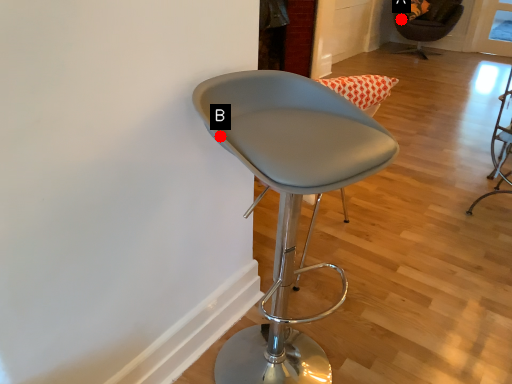
Question: Two points are circled on the image, labeled by A and B beside each circle. Which point appears closest to the camera in this image?

Choices:
 (A) A is closer
 (B) B is closer

Answer: (B)